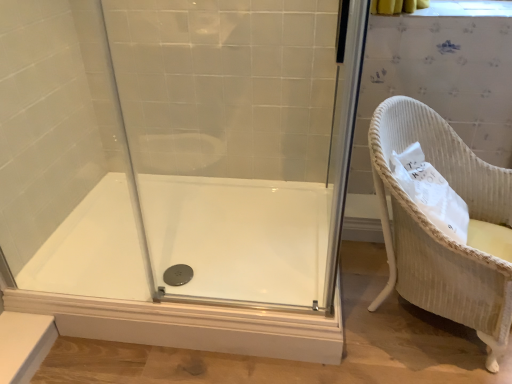
Question: From a real-world perspective, is transparent glass shower door at center physically above white glossy bath at center?

Choices:
 (A) yes
 (B) no

Answer: (A)

Question: Is transparent glass shower door at center bigger than white glossy bath at center?

Choices:
 (A) no
 (B) yes

Answer: (A)

Question: From a real-world perspective, is transparent glass shower door at center beneath white glossy bath at center?

Choices:
 (A) yes
 (B) no

Answer: (B)

Question: Is transparent glass shower door at center far from white glossy bath at center?

Choices:
 (A) no
 (B) yes

Answer: (A)

Question: Is the surface of transparent glass shower door at center in direct contact with white glossy bath at center?

Choices:
 (A) no
 (B) yes

Answer: (A)

Question: Is transparent glass shower door at center taller or shorter than white glossy bath at center?

Choices:
 (A) short
 (B) tall

Answer: (B)

Question: Considering the positions of transparent glass shower door at center and white glossy bath at center in the image, is transparent glass shower door at center bigger or smaller than white glossy bath at center?

Choices:
 (A) big
 (B) small

Answer: (B)

Question: Considering the positions of transparent glass shower door at center and white glossy bath at center in the image, is transparent glass shower door at center wider or thinner than white glossy bath at center?

Choices:
 (A) thin
 (B) wide

Answer: (A)

Question: From the image's perspective, is transparent glass shower door at center located above or below white glossy bath at center?

Choices:
 (A) below
 (B) above

Answer: (B)

Question: Is white glossy bath at center bigger or smaller than transparent glass shower door at center?

Choices:
 (A) big
 (B) small

Answer: (A)

Question: Is white glossy bath at center in front of or behind transparent glass shower door at center in the image?

Choices:
 (A) front
 (B) behind

Answer: (B)

Question: Considering the relative positions of white glossy bath at center and transparent glass shower door at center in the image provided, is white glossy bath at center to the left or to the right of transparent glass shower door at center?

Choices:
 (A) left
 (B) right

Answer: (A)

Question: Is white glossy bath at center taller or shorter than transparent glass shower door at center?

Choices:
 (A) short
 (B) tall

Answer: (A)

Question: Relative to white glossy bath at center, is white wicker chair at right in front or behind?

Choices:
 (A) front
 (B) behind

Answer: (A)

Question: Does point (386, 231) appear closer or farther from the camera than point (37, 251)?

Choices:
 (A) farther
 (B) closer

Answer: (B)